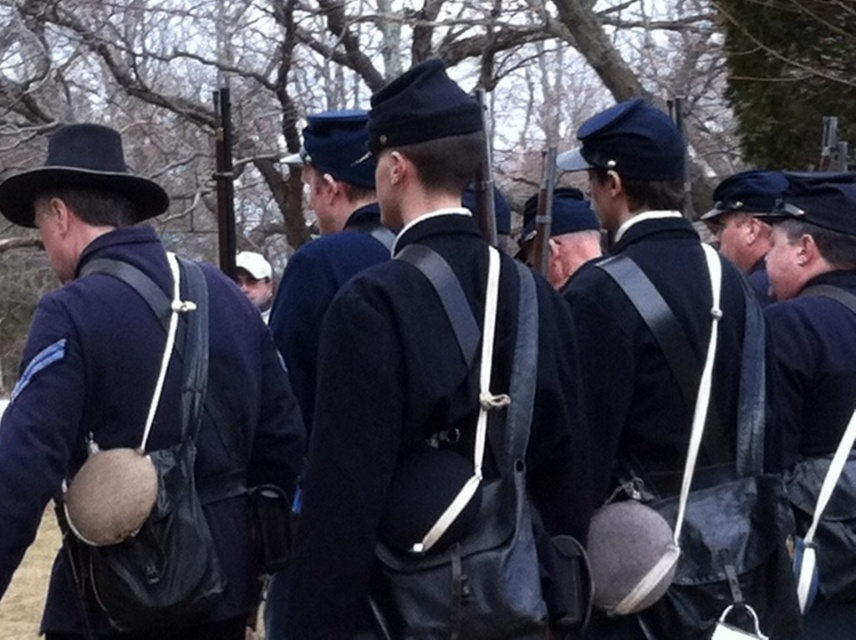
Question: Estimate the real-world distances between objects in this image. Which object is farther from the navy wool jacket at center?

Choices:
 (A) white fabric cap at center
 (B) matte black hat at upper left

Answer: (A)

Question: Is blue wool cap at center to the right of white fabric cap at center from the viewer's perspective?

Choices:
 (A) yes
 (B) no

Answer: (A)

Question: Which point is closer to the camera taking this photo?

Choices:
 (A) (782, 412)
 (B) (605, 380)
 (C) (250, 300)
 (D) (62, 433)

Answer: (D)

Question: Estimate the real-world distances between objects in this image. Which object is farther from the matte black hat at upper left?

Choices:
 (A) matte black backpack at center
 (B) blue wool cap at center
 (C) navy wool jacket at center

Answer: (B)

Question: Can you confirm if matte black hat at upper left is wider than navy wool jacket at center?

Choices:
 (A) no
 (B) yes

Answer: (B)

Question: Does navy wool jacket at center have a greater width compared to matte black backpack at right?

Choices:
 (A) yes
 (B) no

Answer: (A)